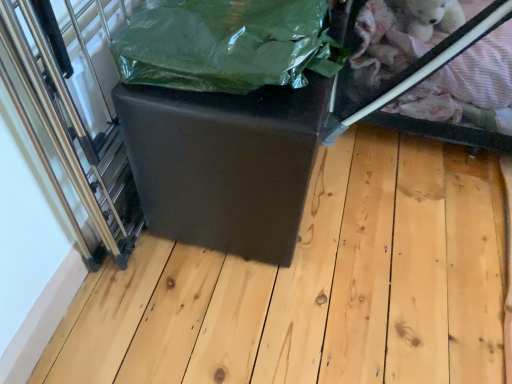
Locate an element on the screen. Image resolution: width=512 pixels, height=384 pixels. vacant location below matte black ottoman at center (from a real-world perspective) is located at coordinates (336, 278).